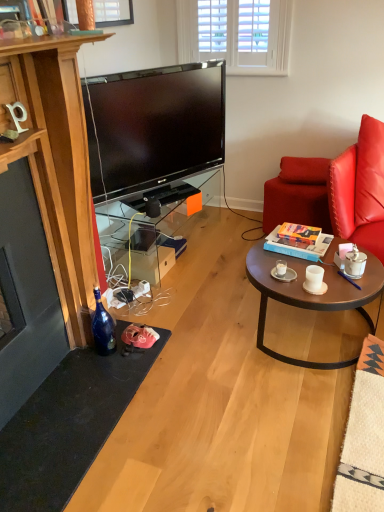
Find the location of `vacant space to the right of purple plastic pen at coffee table`. vacant space to the right of purple plastic pen at coffee table is located at coordinates (374, 277).